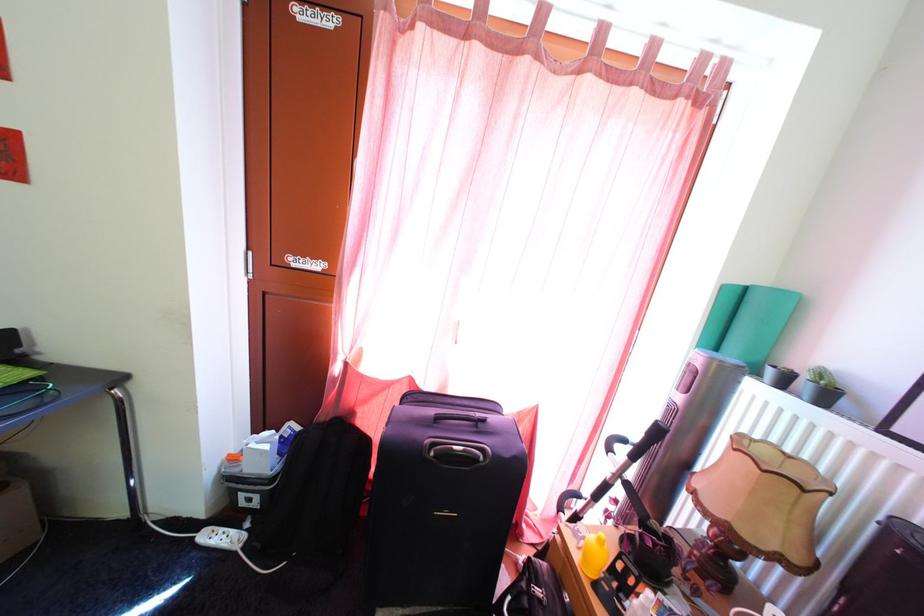
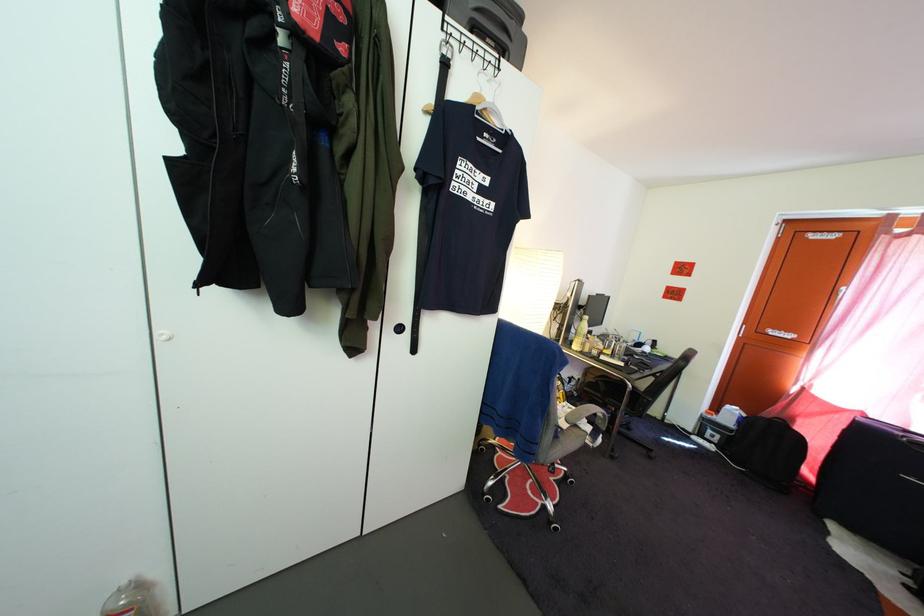
Locate, in the second image, the point that corresponds to (x=259, y=508) in the first image.

(721, 445)